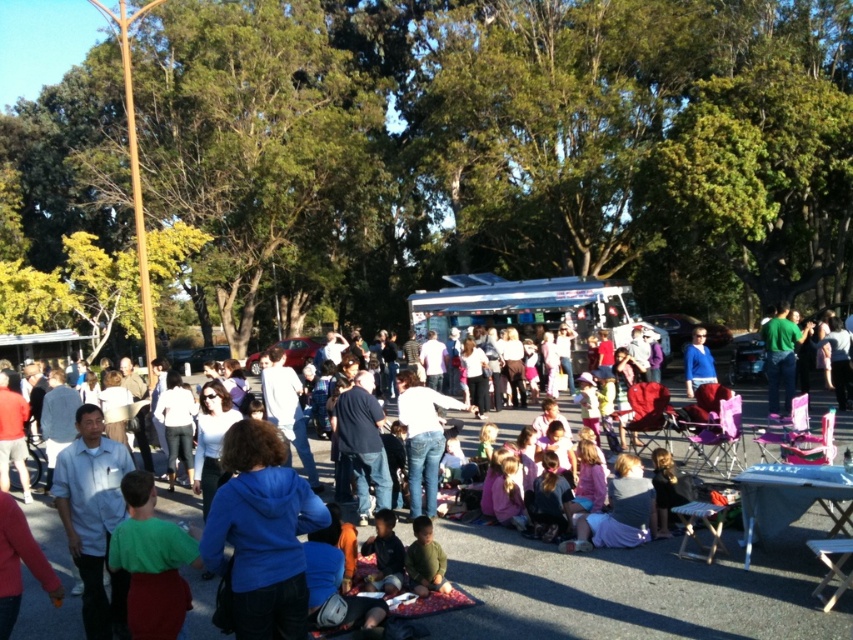
Question: Which object is positioned farthest from the blue fleece jacket at center?

Choices:
 (A) blue fleece jacket at lower center
 (B) jeans at center

Answer: (B)

Question: Can you confirm if blue fleece jacket at center is smaller than jeans at center?

Choices:
 (A) no
 (B) yes

Answer: (B)

Question: Which point appears farthest from the camera in this image?

Choices:
 (A) (242, 605)
 (B) (434, 422)
 (C) (566, 620)

Answer: (B)

Question: Which of the following is the closest to the observer?

Choices:
 (A) blue fleece jacket at lower center
 (B) jeans at center
 (C) blue fleece jacket at center

Answer: (C)

Question: In this image, where is blue fleece jacket at lower center located relative to blue fleece jacket at center?

Choices:
 (A) above
 (B) below

Answer: (B)

Question: Is blue fleece jacket at center to the left of jeans at center from the viewer's perspective?

Choices:
 (A) yes
 (B) no

Answer: (A)